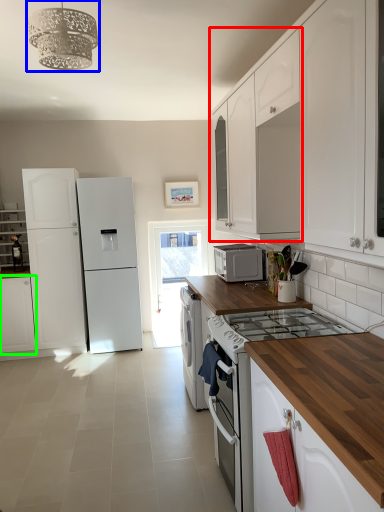
Question: Estimate the real-world distances between objects in this image. Which object is farther from cabinetry (highlighted by a red box), light fixture (highlighted by a blue box) or cabinetry (highlighted by a green box)?

Choices:
 (A) light fixture
 (B) cabinetry

Answer: (B)